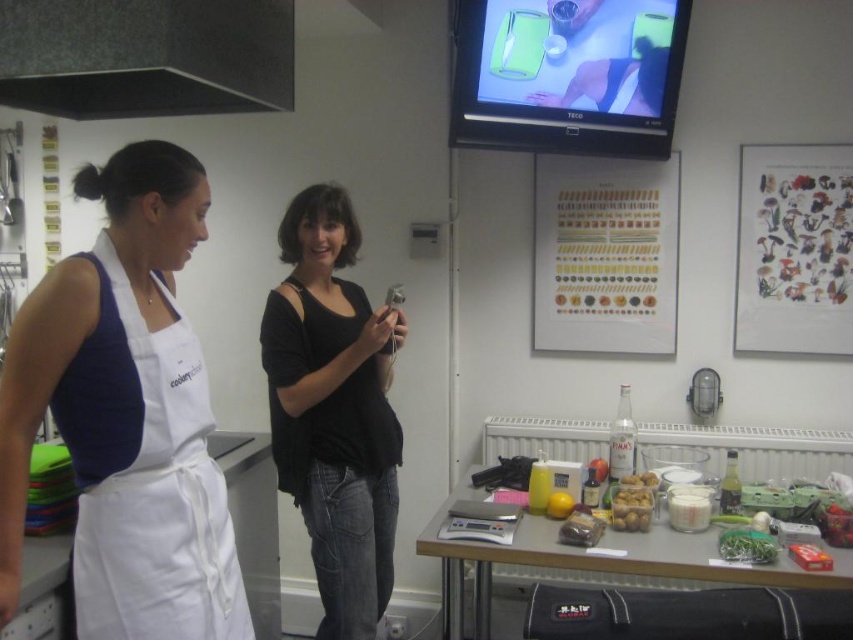
You are a chef trying to determine which clothing item is visible on top. You see the white fabric apron at left and the black cotton shirt at center. Which one is covering the other?

The white fabric apron at left is positioned over the black cotton shirt at center, so the apron is covering the shirt.

You are a chef trying to locate your recipe card. You remember placing it either on the black cotton shirt at center or the wooden poster at upper center. Based on the scene, where is the recipe card most likely located?

The black cotton shirt at center is located below the wooden poster at upper center. Since the recipe card is more likely to be placed on a flat surface like the wooden poster at upper center, the recipe card is probably on the wooden poster at upper center.

You are a delivery person who needs to place a small package between the black cotton shirt at center and the wooden poster at upper center. The package is 3.5 feet long. Will it fit in the space between them?

The distance between the black cotton shirt at center and the wooden poster at upper center is 3.72 feet. Since the package is 3.5 feet long, it will fit as it is shorter than the available space.